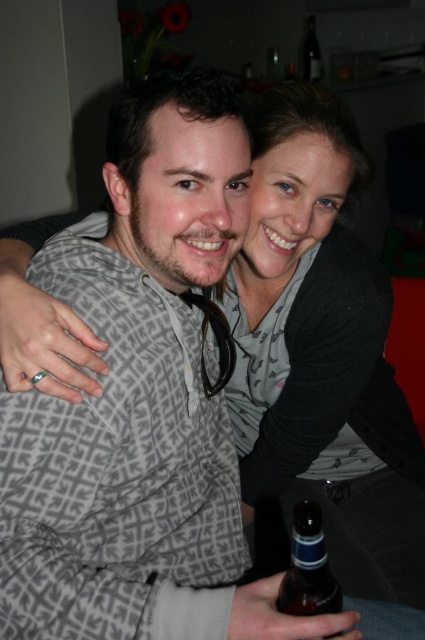
Question: Can you confirm if matte gray sweater at center is smaller than brown glass bottle at lower center?

Choices:
 (A) yes
 (B) no

Answer: (B)

Question: Can you confirm if matte gray sweater at center is smaller than brown glass bottle at lower center?

Choices:
 (A) yes
 (B) no

Answer: (B)

Question: Which object appears closest to the camera in this image?

Choices:
 (A) transparent glass bottle at upper center
 (B) brown glass bottle at lower center

Answer: (B)

Question: Does matte gray sweater at center have a lesser width compared to transparent glass bottle at upper center?

Choices:
 (A) yes
 (B) no

Answer: (B)

Question: Estimate the real-world distances between objects in this image. Which object is closer to the transparent glass bottle at upper center?

Choices:
 (A) brown glass bottle at lower center
 (B) matte gray sweater at center

Answer: (B)

Question: Which point is closer to the camera?

Choices:
 (A) transparent glass bottle at upper center
 (B) brown glass bottle at lower center

Answer: (B)